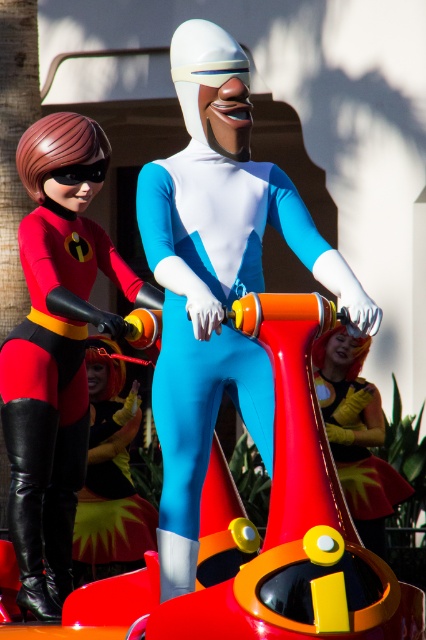
You are a photographer positioned behind the vehicle. You want to take a photo of both the white matte suit at center and the matte black bodysuit at left. Which one will appear closer to the camera in the photo?

The white matte suit at center will appear closer to the camera because it is positioned in front of the matte black bodysuit at left.

You are a photographer trying to capture a clear shot of both the white matte suit at center and the shiny metallic helmet at center. Since you want to focus on the taller object first, which one should you adjust your camera settings for?

The shiny metallic helmet at center is taller than the white matte suit at center, so you should adjust your camera settings for the shiny metallic helmet at center first.

You are a photographer trying to capture a clear shot of the shiny gold helmet at center. However, the matte black bodysuit at left is blocking your view. Can you adjust your position to see the helmet without moving the objects?

The matte black bodysuit at left is positioned over the shiny gold helmet at center, so moving to the side might allow you to see the helmet underneath.